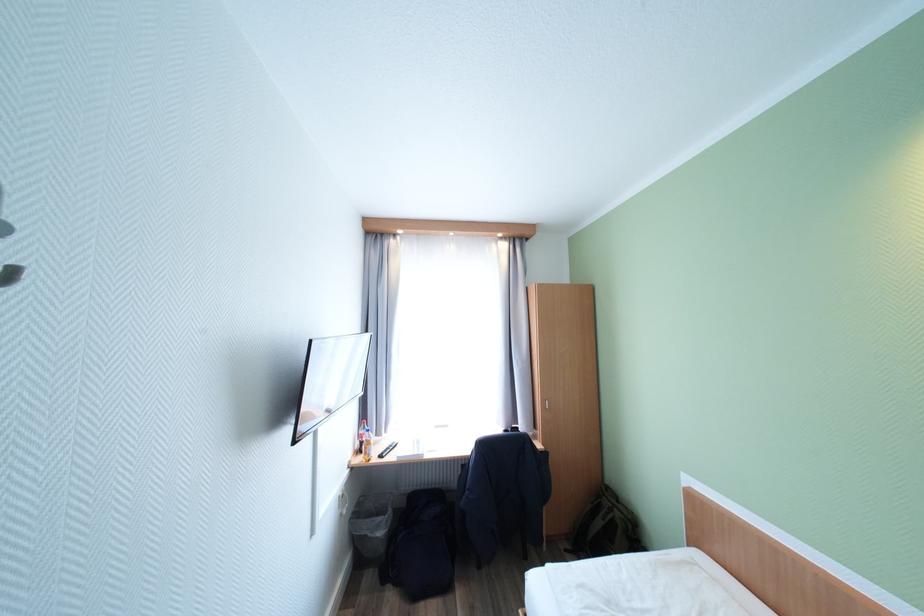
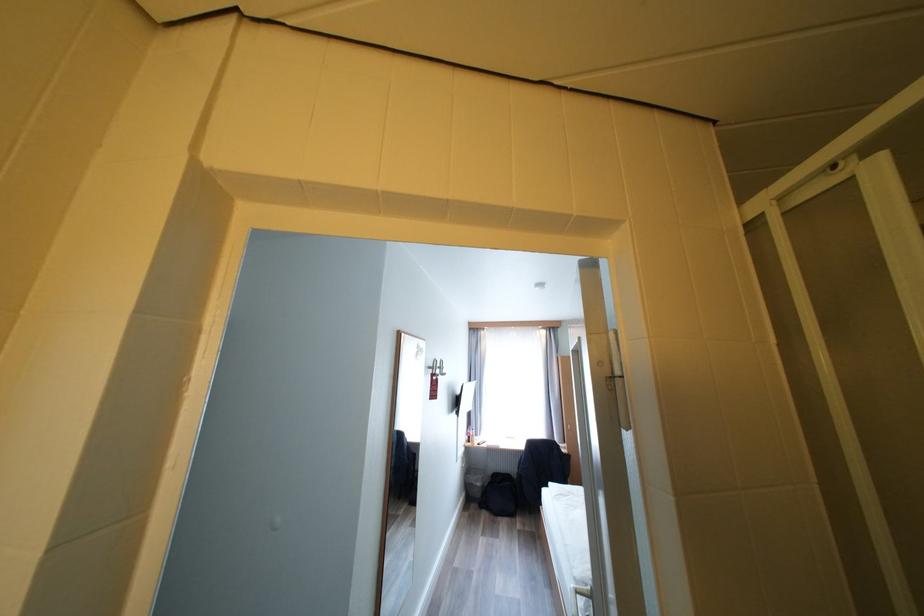
Question: The images are taken continuously from a first-person perspective. In which direction are you moving?

Choices:
 (A) Left
 (B) Right
 (C) Forward
 (D) Backward

Answer: (D)